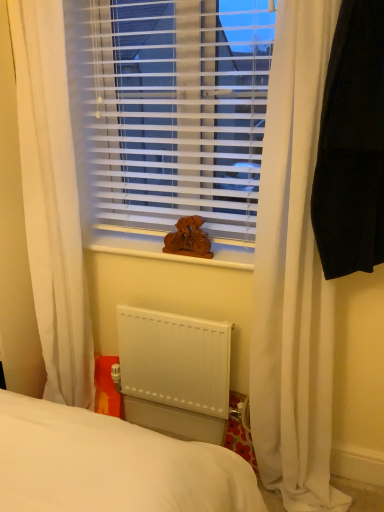
Question: From the image's perspective, would you say wooden statue at center is positioned over wooden statue at center?

Choices:
 (A) yes
 (B) no

Answer: (A)

Question: Considering the relative sizes of wooden statue at center and wooden statue at center in the image provided, is wooden statue at center shorter than wooden statue at center?

Choices:
 (A) yes
 (B) no

Answer: (B)

Question: Considering the relative sizes of wooden statue at center and wooden statue at center in the image provided, is wooden statue at center bigger than wooden statue at center?

Choices:
 (A) yes
 (B) no

Answer: (B)

Question: Does wooden statue at center have a greater height compared to wooden statue at center?

Choices:
 (A) yes
 (B) no

Answer: (A)

Question: Could you tell me if wooden statue at center is turned towards wooden statue at center?

Choices:
 (A) yes
 (B) no

Answer: (B)

Question: Considering the relative sizes of wooden statue at center and wooden statue at center in the image provided, is wooden statue at center thinner than wooden statue at center?

Choices:
 (A) yes
 (B) no

Answer: (A)

Question: Is black fabric at right, the second curtain from the left, surrounding white matte radiator at lower center?

Choices:
 (A) yes
 (B) no

Answer: (B)

Question: Is black fabric at right, the second curtain from the left, at the right side of white matte radiator at lower center?

Choices:
 (A) yes
 (B) no

Answer: (A)

Question: From the image's perspective, would you say black fabric at right, the second curtain from the left, is shown under white matte radiator at lower center?

Choices:
 (A) yes
 (B) no

Answer: (B)

Question: Considering the relative sizes of black fabric at right, the second curtain from the left, and white matte radiator at lower center in the image provided, is black fabric at right, the second curtain from the left, smaller than white matte radiator at lower center?

Choices:
 (A) yes
 (B) no

Answer: (B)

Question: Considering the relative sizes of black fabric at right, the second curtain from the left, and white matte radiator at lower center in the image provided, is black fabric at right, the second curtain from the left, wider than white matte radiator at lower center?

Choices:
 (A) no
 (B) yes

Answer: (B)

Question: Is black fabric at right, marked as the first curtain in a right-to-left arrangement, further to the viewer compared to white matte radiator at lower center?

Choices:
 (A) no
 (B) yes

Answer: (A)

Question: Considering the relative sizes of wooden statue at center and white plastic blinds at center in the image provided, is wooden statue at center wider than white plastic blinds at center?

Choices:
 (A) yes
 (B) no

Answer: (B)